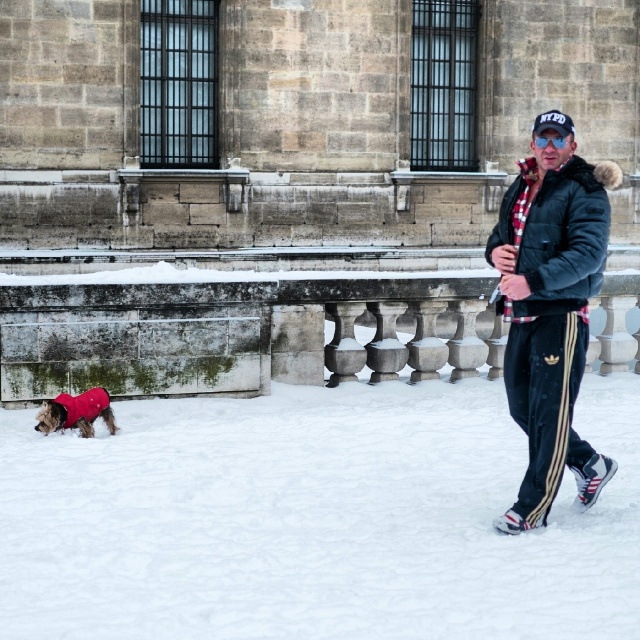
You are standing in front of the stone building and want to walk from point A to point B. Point A is located at coordinates point [604,497] and point B is at point [518,417]. Which point is closer to you when you start walking?

Point A at point [604,497] is closer to you because it is further to the viewer than point B at point [518,417].

You are standing in the snowy outdoor scene and want to locate the plaid woolen jacket at center. According to the coordinates provided, where exactly would you find it?

The plaid woolen jacket at center is located at point (x=564, y=237).

You are a photographer trying to capture the man and his dog in front of the stone building. You notice the plaid woolen jacket at center and the red fleece coat at lower left. Which clothing item is closer to the camera?

The plaid woolen jacket at center is closer to the camera because it is in front of the red fleece coat at lower left.